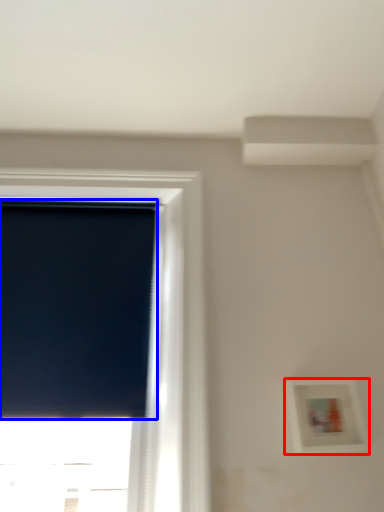
Question: Among these objects, which one is farthest to the camera, picture frame (highlighted by a red box) or window screen (highlighted by a blue box)?

Choices:
 (A) picture frame
 (B) window screen

Answer: (B)